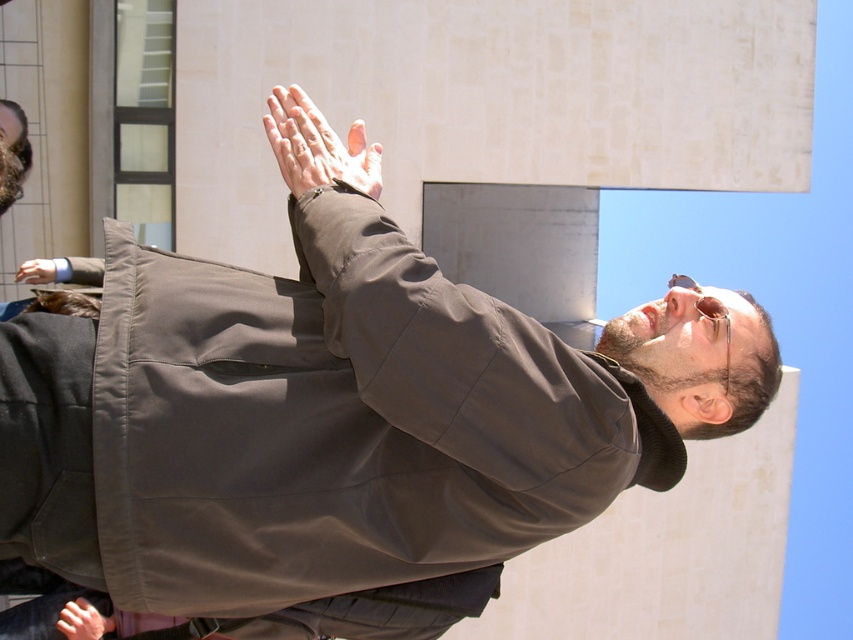
Question: Does smooth skin hand at center appear over smooth skin hand at lower left?

Choices:
 (A) yes
 (B) no

Answer: (A)

Question: Which point is farther to the camera?

Choices:
 (A) smooth skin hand at center
 (B) matte black hand at lower left
 (C) sunglasses at upper center

Answer: (B)

Question: Which point is closer to the camera?

Choices:
 (A) sunglasses at upper center
 (B) smooth skin hand at lower left
 (C) matte black hand at lower left
 (D) smooth skin hand at center

Answer: (D)

Question: Does smooth skin hand at lower left appear over matte black hand at lower left?

Choices:
 (A) no
 (B) yes

Answer: (A)

Question: Which object appears farthest from the camera in this image?

Choices:
 (A) sunglasses at upper center
 (B) matte black hand at lower left
 (C) smooth skin hand at lower left
 (D) smooth skin hand at center

Answer: (B)

Question: Can you confirm if smooth skin hand at center is smaller than sunglasses at upper center?

Choices:
 (A) yes
 (B) no

Answer: (B)